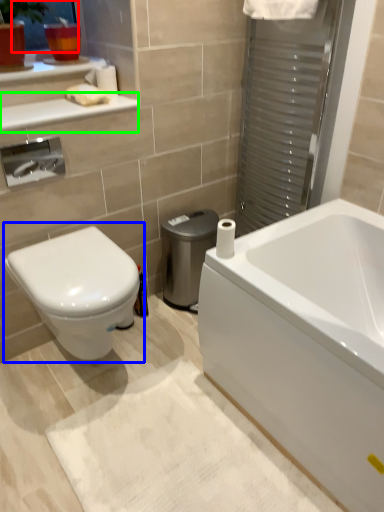
Question: Which object is positioned closest to window screen (highlighted by a red box)? Select from toilet (highlighted by a blue box) and balustrade (highlighted by a green box).

Choices:
 (A) toilet
 (B) balustrade

Answer: (B)